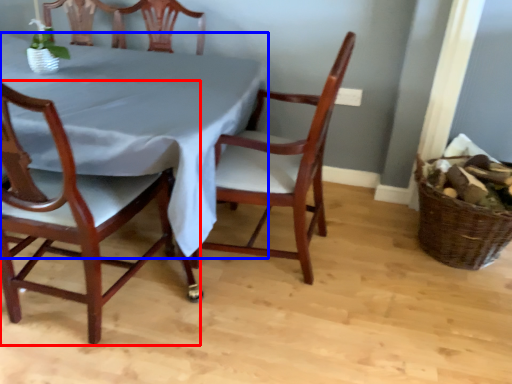
Question: Which object is closer to the camera taking this photo, chair (highlighted by a red box) or tablecloth (highlighted by a blue box)?

Choices:
 (A) chair
 (B) tablecloth

Answer: (A)